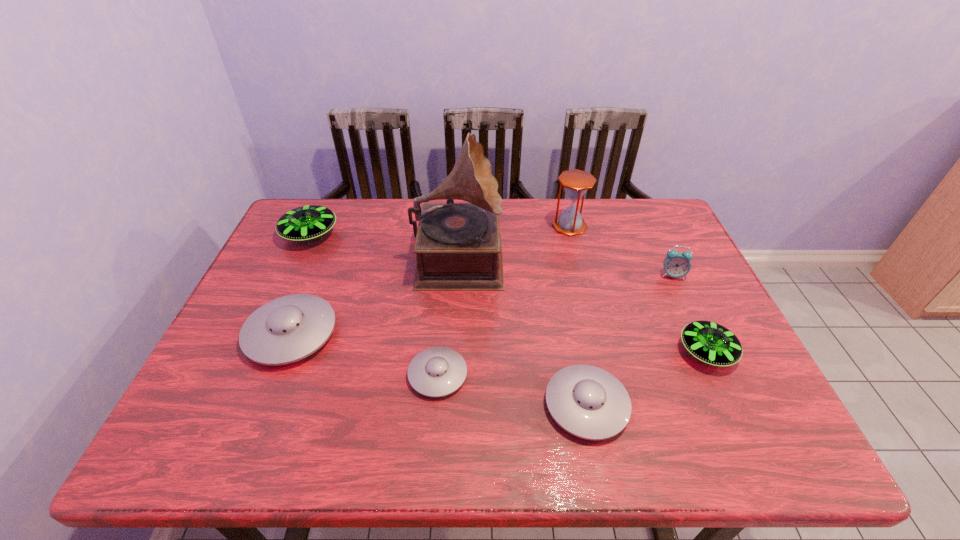
Locate which saucer is the fifth closest to the record player. Please provide its 2D coordinates. Your answer should be formatted as a tuple, i.e. [(x, y)], where the tuple contains the x and y coordinates of a point satisfying the conditions above.

[(709, 342)]

Identify which saucer is the closest to the alarm clock. Please provide its 2D coordinates. Your answer should be formatted as a tuple, i.e. [(x, y)], where the tuple contains the x and y coordinates of a point satisfying the conditions above.

[(709, 342)]

This screenshot has height=540, width=960. I want to click on gray saucer that is the second closest one to the rightmost gray saucer, so click(x=287, y=329).

Locate an element on the screen. The height and width of the screenshot is (540, 960). gray saucer that is the second closest to the third saucer from left to right is located at coordinates (287, 329).

You are a GUI agent. You are given a task and a screenshot of the screen. Output one action in this format:
    pyautogui.click(x=<x>, y=<y>)
    Task: Click on the free point that satisfies the following two spatial constraints: 1. on the front side of the second tallest object; 2. on the left side of the rightmost saucer
    
    Given the screenshot: What is the action you would take?
    pyautogui.click(x=601, y=352)

Find the location of a particular element. The image size is (960, 540). free space that satisfies the following two spatial constraints: 1. on the back side of the rightmost saucer; 2. on the right side of the second gray saucer from right to left is located at coordinates (440, 352).

Image resolution: width=960 pixels, height=540 pixels. In order to click on vacant space that satisfies the following two spatial constraints: 1. from the horn of the tallest object; 2. on the right side of the second biggest gray saucer in this screenshot , I will do `click(450, 405)`.